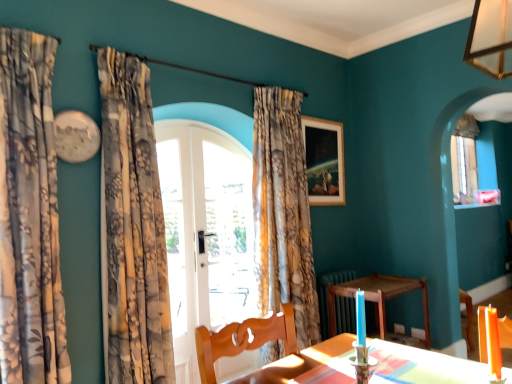
Question: Considering the relative positions of floral fabric curtain at left, arranged as the second curtain when viewed from the right, and orange wax candle at lower right in the image provided, is floral fabric curtain at left, arranged as the second curtain when viewed from the right, behind orange wax candle at lower right?

Choices:
 (A) no
 (B) yes

Answer: (B)

Question: Is floral fabric curtain at left, the 2th curtain from the left, smaller than orange wax candle at lower right?

Choices:
 (A) yes
 (B) no

Answer: (B)

Question: Considering the relative sizes of floral fabric curtain at left, which is counted as the 2th curtain, starting from the back, and orange wax candle at lower right in the image provided, is floral fabric curtain at left, which is counted as the 2th curtain, starting from the back, thinner than orange wax candle at lower right?

Choices:
 (A) no
 (B) yes

Answer: (A)

Question: From a real-world perspective, is floral fabric curtain at left, the 2th curtain from the left, positioned under orange wax candle at lower right based on gravity?

Choices:
 (A) no
 (B) yes

Answer: (A)

Question: Could orange wax candle at lower right be considered to be inside floral fabric curtain at left, which is counted as the 2th curtain, starting from the back?

Choices:
 (A) no
 (B) yes

Answer: (A)

Question: Can you confirm if floral fabric curtain at left, which is counted as the 2th curtain, starting from the back, is shorter than orange wax candle at lower right?

Choices:
 (A) yes
 (B) no

Answer: (B)

Question: Is floral fabric curtain at center, the 1th curtain in the back-to-front sequence, oriented away from floral fabric curtain at left, the second curtain when ordered from front to back?

Choices:
 (A) yes
 (B) no

Answer: (B)

Question: Considering the relative positions of floral fabric curtain at center, which ranks as the third curtain in front-to-back order, and floral fabric curtain at left, the 2th curtain from the left, in the image provided, is floral fabric curtain at center, which ranks as the third curtain in front-to-back order, to the right of floral fabric curtain at left, the 2th curtain from the left, from the viewer's perspective?

Choices:
 (A) no
 (B) yes

Answer: (B)

Question: From a real-world perspective, is floral fabric curtain at center, which ranks as the third curtain in front-to-back order, positioned under floral fabric curtain at left, the 2th curtain from the left, based on gravity?

Choices:
 (A) no
 (B) yes

Answer: (B)

Question: Is floral fabric curtain at left, the second curtain when ordered from front to back, inside floral fabric curtain at center, which ranks as the third curtain in front-to-back order?

Choices:
 (A) yes
 (B) no

Answer: (B)

Question: From the image's perspective, does floral fabric curtain at center, the 1th curtain in the back-to-front sequence, appear lower than floral fabric curtain at left, which is counted as the 2th curtain, starting from the back?

Choices:
 (A) no
 (B) yes

Answer: (B)

Question: Considering the relative positions of floral fabric curtain at center, the 1th curtain in the back-to-front sequence, and floral fabric curtain at left, the second curtain when ordered from front to back, in the image provided, is floral fabric curtain at center, the 1th curtain in the back-to-front sequence, in front of floral fabric curtain at left, the second curtain when ordered from front to back,?

Choices:
 (A) yes
 (B) no

Answer: (B)

Question: Is clear glass door at center facing towards floral fabric curtain at center, positioned as the third curtain in left-to-right order?

Choices:
 (A) yes
 (B) no

Answer: (A)